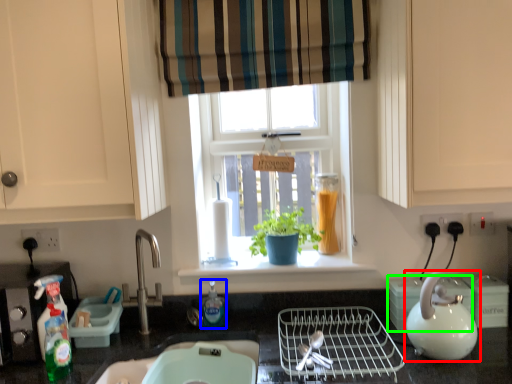
Question: Estimate the real-world distances between objects in this image. Which object is farther from kettle (highlighted by a red box), bottle (highlighted by a blue box) or appliance (highlighted by a green box)?

Choices:
 (A) bottle
 (B) appliance

Answer: (A)